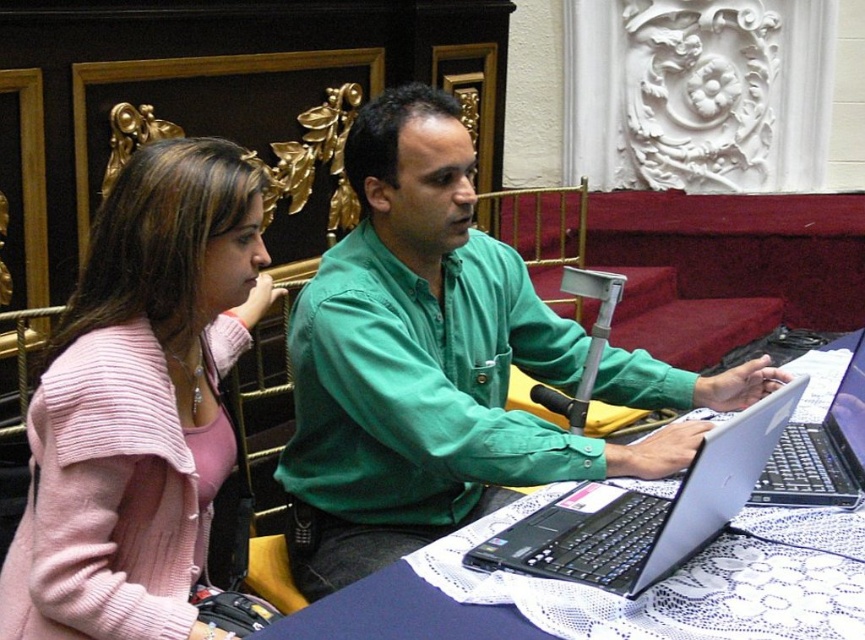
You are an attendee at a formal event and want to approach the white lace table at center to retrieve a document. However, there is a person wearing the pink knitted sweater at upper left in your path. Can you walk directly to the table without going around them?

The pink knitted sweater at upper left is further to the viewer than the white lace table at center, meaning the sweater is closer to you. Therefore, you would need to go around the person in the pink knitted sweater at upper left to reach the white lace table at center directly.

You are a photographer taking a picture of the scene. You want to ensure both the pink knitted sweater at upper left and the black plastic laptop at center are clearly visible in the photo. Based on their positions, which object might be partially obscured if you focus on the other?

The pink knitted sweater at upper left is in front of the black plastic laptop at center, so focusing on the sweater could obscure part of the laptop, while focusing on the laptop might hide part of the sweater.

You are standing at the entrance of the room and want to locate the pink knitted sweater at upper left. According to the coordinates provided, where should you look relative to the center of the image?

The pink knitted sweater at upper left is located at coordinates point (139,403), which is to the upper left of the center of the image.